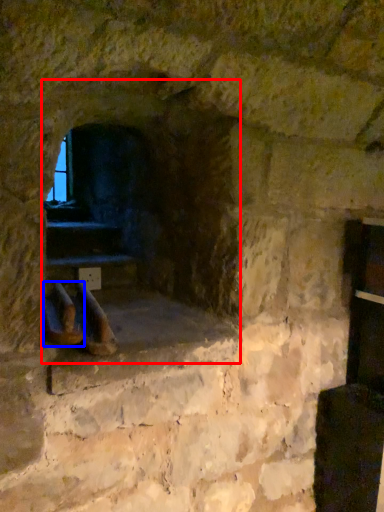
Question: Which of the following is the closest to the observer, fireplace (highlighted by a red box) or footwear (highlighted by a blue box)?

Choices:
 (A) fireplace
 (B) footwear

Answer: (B)